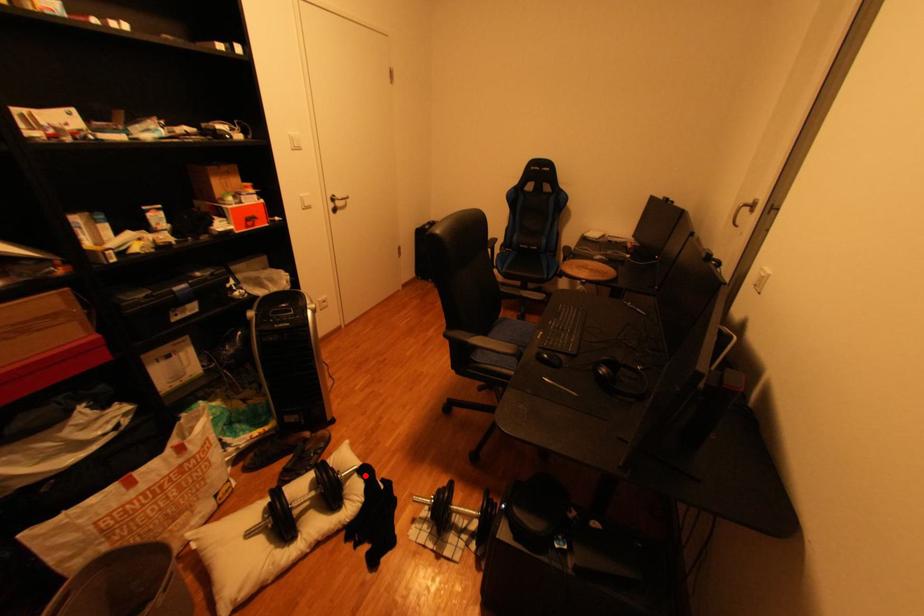
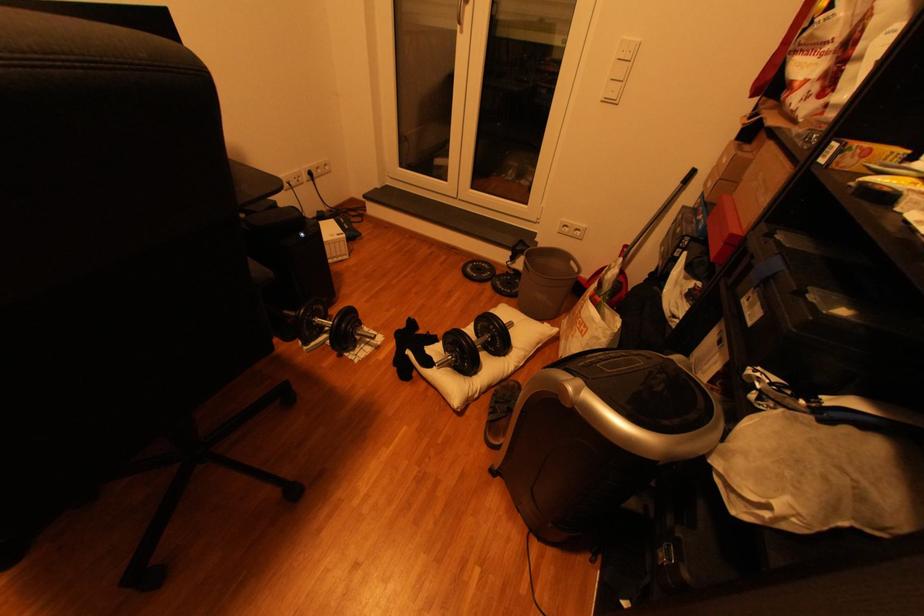
Find the pixel in the second image that matches the highlighted location in the first image.

(445, 361)